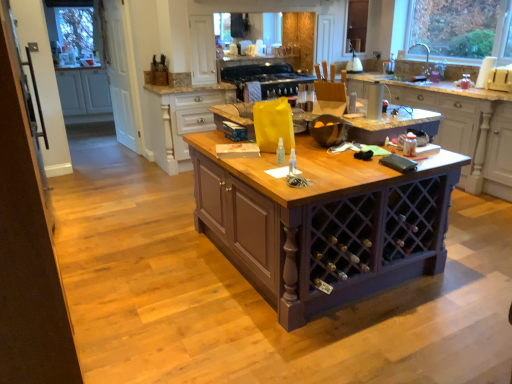
Question: Is white matte cabinet at left, the 1th cabinetry from the left, to the right of clear glass door at left from the viewer's perspective?

Choices:
 (A) yes
 (B) no

Answer: (B)

Question: Is white matte cabinet at left, the 1th cabinetry from the left, surrounding clear glass door at left?

Choices:
 (A) yes
 (B) no

Answer: (B)

Question: Considering the relative positions of white matte cabinet at left, the 1th cabinetry from the left, and clear glass door at left in the image provided, is white matte cabinet at left, the 1th cabinetry from the left, to the left of clear glass door at left from the viewer's perspective?

Choices:
 (A) no
 (B) yes

Answer: (B)

Question: Is white matte cabinet at left, which is the third cabinetry from right to left, positioned in front of clear glass door at left?

Choices:
 (A) yes
 (B) no

Answer: (B)

Question: Is white matte cabinet at left, which is the third cabinetry from right to left, oriented away from clear glass door at left?

Choices:
 (A) yes
 (B) no

Answer: (B)

Question: From a real-world perspective, is white wood cabinet at upper center, marked as the second cabinetry in a front-to-back arrangement, physically located above or below white glossy kettle at upper center, the first appliance viewed from the top?

Choices:
 (A) above
 (B) below

Answer: (B)

Question: In the image, is white wood cabinet at upper center, which is the 2th cabinetry from back to front, positioned in front of or behind white glossy kettle at upper center, which is the first appliance in right-to-left order?

Choices:
 (A) behind
 (B) front

Answer: (B)

Question: Is white wood cabinet at upper center, which appears as the second cabinetry when viewed from the left, wider or thinner than white glossy kettle at upper center, the first appliance viewed from the top?

Choices:
 (A) wide
 (B) thin

Answer: (A)

Question: In terms of size, does white wood cabinet at upper center, which appears as the second cabinetry when viewed from the left, appear bigger or smaller than white glossy kettle at upper center, which is the first appliance in right-to-left order?

Choices:
 (A) big
 (B) small

Answer: (A)

Question: Considering the positions of point (316, 120) and point (106, 13), is point (316, 120) closer or farther from the camera than point (106, 13)?

Choices:
 (A) farther
 (B) closer

Answer: (B)

Question: Visually, is black matte bowl at center, marked as the 2th appliance in a top-to-bottom arrangement, positioned to the left or to the right of clear glass door at left?

Choices:
 (A) right
 (B) left

Answer: (A)

Question: From their relative heights in the image, would you say black matte bowl at center, the first appliance viewed from the front, is taller or shorter than clear glass door at left?

Choices:
 (A) tall
 (B) short

Answer: (B)

Question: Is black matte bowl at center, the first appliance viewed from the front, spatially inside clear glass door at left, or outside of it?

Choices:
 (A) inside
 (B) outside

Answer: (B)

Question: From the image's perspective, is white matte cabinet at left, which is the third cabinetry from right to left, located above or below white wood cabinet at upper center, which is the 2th cabinetry in right-to-left order?

Choices:
 (A) below
 (B) above

Answer: (B)

Question: Does point (103, 91) appear closer or farther from the camera than point (159, 104)?

Choices:
 (A) closer
 (B) farther

Answer: (B)